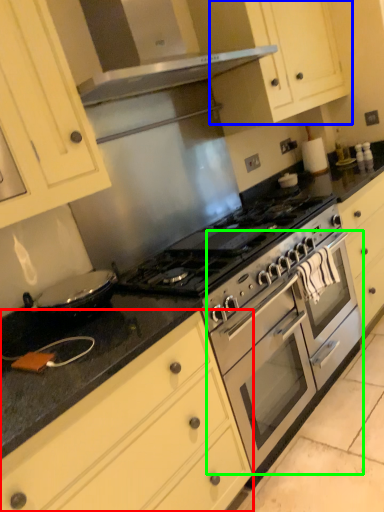
Question: Estimate the real-world distances between objects in this image. Which object is farther from cabinetry (highlighted by a red box), cabinetry (highlighted by a blue box) or oven (highlighted by a green box)?

Choices:
 (A) cabinetry
 (B) oven

Answer: (A)